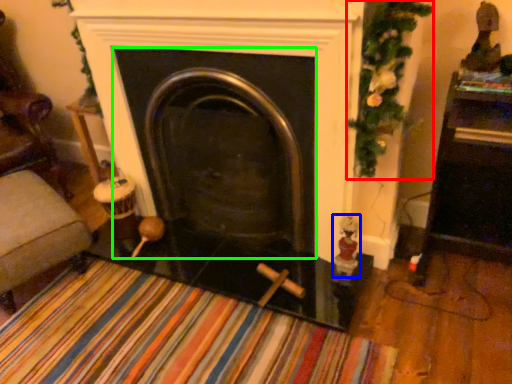
Question: Which object is the closest to the christmas decoration (highlighted by a red box)? Choose among these: toy (highlighted by a blue box) or fireplace (highlighted by a green box).

Choices:
 (A) toy
 (B) fireplace

Answer: (B)